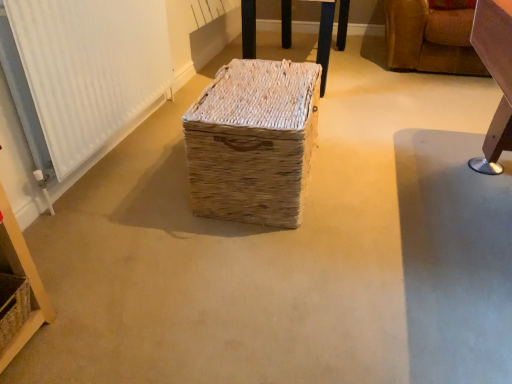
Question: From the image's perspective, is leather sofa at upper right, which ranks as the second furniture in left-to-right order, located above natural woven basket at lower left?

Choices:
 (A) yes
 (B) no

Answer: (A)

Question: From a real-world perspective, is leather sofa at upper right, which is the first furniture from right to left, beneath natural woven basket at lower left?

Choices:
 (A) no
 (B) yes

Answer: (A)

Question: Is leather sofa at upper right, which is the first furniture from right to left, aimed at natural woven basket at lower left?

Choices:
 (A) no
 (B) yes

Answer: (A)

Question: Can you confirm if leather sofa at upper right, which ranks as the second furniture in left-to-right order, is positioned to the left of natural woven basket at lower left?

Choices:
 (A) no
 (B) yes

Answer: (A)

Question: Can you confirm if leather sofa at upper right, which is the first furniture from right to left, is taller than natural woven basket at lower left?

Choices:
 (A) yes
 (B) no

Answer: (A)

Question: Can natural woven basket at lower left be found inside leather sofa at upper right, which is the first furniture from right to left?

Choices:
 (A) yes
 (B) no

Answer: (B)

Question: From a real-world perspective, does natural woven basket at center, which ranks as the first furniture in left-to-right order, sit lower than natural woven basket at lower left?

Choices:
 (A) no
 (B) yes

Answer: (A)

Question: Is natural woven basket at center, which ranks as the first furniture in left-to-right order, located outside natural woven basket at lower left?

Choices:
 (A) yes
 (B) no

Answer: (A)

Question: Can you confirm if natural woven basket at center, the second furniture positioned from the right, is thinner than natural woven basket at lower left?

Choices:
 (A) yes
 (B) no

Answer: (B)

Question: Does natural woven basket at center, the second furniture positioned from the right, come in front of natural woven basket at lower left?

Choices:
 (A) no
 (B) yes

Answer: (A)

Question: Is natural woven basket at center, the second furniture positioned from the right, smaller than natural woven basket at lower left?

Choices:
 (A) no
 (B) yes

Answer: (A)

Question: From the image's perspective, does natural woven basket at center, the second furniture positioned from the right, appear lower than natural woven basket at lower left?

Choices:
 (A) yes
 (B) no

Answer: (B)

Question: Can you confirm if white textured radiator at left is wider than natural woven basket at center, which ranks as the first furniture in left-to-right order?

Choices:
 (A) no
 (B) yes

Answer: (A)